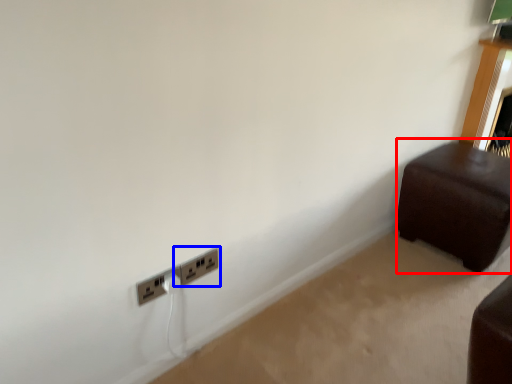
Question: Which of the following is the farthest to the observer, furniture (highlighted by a red box) or power plugs and sockets (highlighted by a blue box)?

Choices:
 (A) furniture
 (B) power plugs and sockets

Answer: (A)